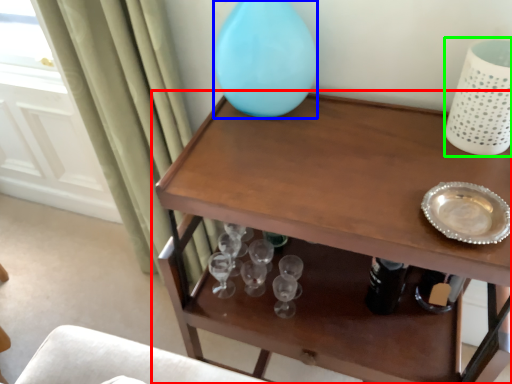
Question: Which object is positioned farthest from table (highlighted by a red box)? Select from vase (highlighted by a blue box) and vase (highlighted by a green box).

Choices:
 (A) vase
 (B) vase

Answer: (B)